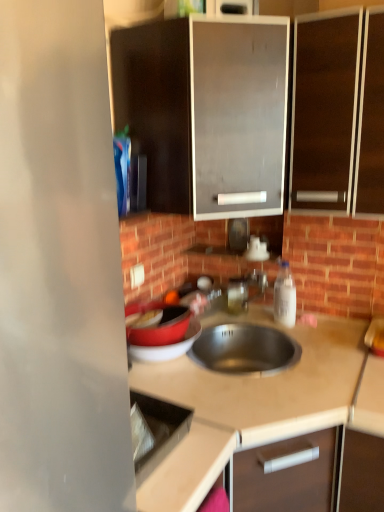
You are a GUI agent. You are given a task and a screenshot of the screen. Output one action in this format:
    pyautogui.click(x=<x>, y=<y>)
    Task: Click on the vacant area located to the right-hand side of white plastic bottle at right
    The height and width of the screenshot is (512, 384).
    Given the screenshot: What is the action you would take?
    pyautogui.click(x=328, y=330)